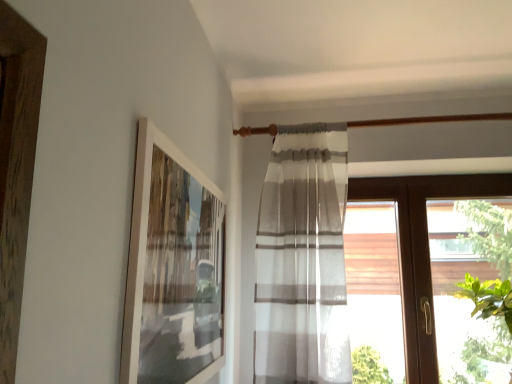
Find the location of a particular element. green leafy plant at right is located at coordinates (487, 283).

Describe the element at coordinates (303, 259) in the screenshot. I see `white sheer curtain at center` at that location.

In order to face white matte picture frame at upper left, should I rotate leftwards or rightwards?

You should rotate left by 8.029 degrees.

Identify the location of green leafy plant at right. Image resolution: width=512 pixels, height=384 pixels. (487, 283).

From the picture: Is white matte picture frame at upper left not near white sheer curtain at center?

They are positioned close to each other.

How distant is white matte picture frame at upper left from white sheer curtain at center?

The distance of white matte picture frame at upper left from white sheer curtain at center is 20.54 inches.

Is the depth of white matte picture frame at upper left greater than that of white sheer curtain at center?

No, the depth of white matte picture frame at upper left is less than that of white sheer curtain at center.

From the image's perspective, which one is positioned lower, white matte picture frame at upper left or white sheer curtain at center?

white sheer curtain at center appears lower in the image.

Looking at this image, can you confirm if white sheer curtain at center is bigger than green leafy plant at right?

Incorrect, white sheer curtain at center is not larger than green leafy plant at right.

Which of these two, white sheer curtain at center or green leafy plant at right, stands shorter?

Standing shorter between the two is green leafy plant at right.

From the image's perspective, which is below, white sheer curtain at center or green leafy plant at right?

green leafy plant at right.

Who is more distant, white sheer curtain at center or green leafy plant at right?

white sheer curtain at center is behind.

Is white sheer curtain at center shorter than brown wood window at right?

No, white sheer curtain at center is not shorter than brown wood window at right.

Is white sheer curtain at center looking in the opposite direction of brown wood window at right?

No, brown wood window at right is not at the back of white sheer curtain at center.

From the image's perspective, is white sheer curtain at center located above or below brown wood window at right?

Based on their image positions, white sheer curtain at center is located above brown wood window at right.

This screenshot has height=384, width=512. I want to click on picture frame located in front of the brown wood window at right, so click(173, 268).

From the picture: Does brown wood window at right appear on the left side of white matte picture frame at upper left?

In fact, brown wood window at right is to the right of white matte picture frame at upper left.

From their relative heights in the image, would you say brown wood window at right is taller or shorter than white matte picture frame at upper left?

brown wood window at right is taller than white matte picture frame at upper left.

Is white matte picture frame at upper left looking in the opposite direction of brown wood window at right?

No, brown wood window at right is not at the back of white matte picture frame at upper left.

Does white matte picture frame at upper left have a greater height compared to brown wood window at right?

In fact, white matte picture frame at upper left may be shorter than brown wood window at right.

Would you say white matte picture frame at upper left is inside or outside brown wood window at right?

white matte picture frame at upper left is not inside brown wood window at right, it's outside.

From the image's perspective, which is above, green leafy plant at right or brown wood window at right?

brown wood window at right appears higher in the image.

Can you confirm if green leafy plant at right is positioned to the right of brown wood window at right?

Yes.

Considering the points (480, 287) and (488, 174), which point is in front, point (480, 287) or point (488, 174)?

The point (480, 287) is more forward.

Does green leafy plant at right touch brown wood window at right?

No, green leafy plant at right is not making contact with brown wood window at right.

Is point (503, 332) positioned behind point (314, 252)?

Yes.

Would you say green leafy plant at right is inside or outside white sheer curtain at center?

green leafy plant at right is located beyond the bounds of white sheer curtain at center.

Is green leafy plant at right not near white sheer curtain at center?

Yes, green leafy plant at right is far from white sheer curtain at center.

Where is `curtain on the right of white matte picture frame at upper left`? curtain on the right of white matte picture frame at upper left is located at coordinates (303, 259).

In the image, there is a white sheer curtain at center. Where is `plant below it (from a real-world perspective)`? plant below it (from a real-world perspective) is located at coordinates (487, 283).

Consider the image. Which object lies nearer to the anchor point green leafy plant at right, white matte picture frame at upper left or white sheer curtain at center?

Among the two, white sheer curtain at center is located nearer to green leafy plant at right.

Looking at the image, which one is located closer to green leafy plant at right, brown wood window at right or white sheer curtain at center?

brown wood window at right lies closer to green leafy plant at right than the other object.

Looking at the image, which one is located further to brown wood window at right, white matte picture frame at upper left or green leafy plant at right?

Among the two, white matte picture frame at upper left is located further to brown wood window at right.

Estimate the real-world distances between objects in this image. Which object is further from brown wood window at right, white sheer curtain at center or green leafy plant at right?

Based on the image, green leafy plant at right appears to be further to brown wood window at right.

From the image, which object appears to be nearer to white matte picture frame at upper left, green leafy plant at right or brown wood window at right?

brown wood window at right is closer to white matte picture frame at upper left.

Which object lies nearer to the anchor point white sheer curtain at center, brown wood window at right or green leafy plant at right?

brown wood window at right lies closer to white sheer curtain at center than the other object.

Estimate the real-world distances between objects in this image. Which object is further from green leafy plant at right, white sheer curtain at center or white matte picture frame at upper left?

The object further to green leafy plant at right is white matte picture frame at upper left.

From the image, which object appears to be nearer to green leafy plant at right, white sheer curtain at center or brown wood window at right?

brown wood window at right.

You are a GUI agent. You are given a task and a screenshot of the screen. Output one action in this format:
    pyautogui.click(x=<x>, y=<y>)
    Task: Click on the window between white matte picture frame at upper left and green leafy plant at right from left to right
    
    Given the screenshot: What is the action you would take?
    pyautogui.click(x=421, y=248)

Locate an element on the screen. The width and height of the screenshot is (512, 384). window situated between white sheer curtain at center and green leafy plant at right from left to right is located at coordinates (421, 248).

Locate an element on the screen. This screenshot has width=512, height=384. curtain between white matte picture frame at upper left and green leafy plant at right is located at coordinates (303, 259).

Image resolution: width=512 pixels, height=384 pixels. Identify the location of curtain between white matte picture frame at upper left and brown wood window at right in the front-back direction. (303, 259).